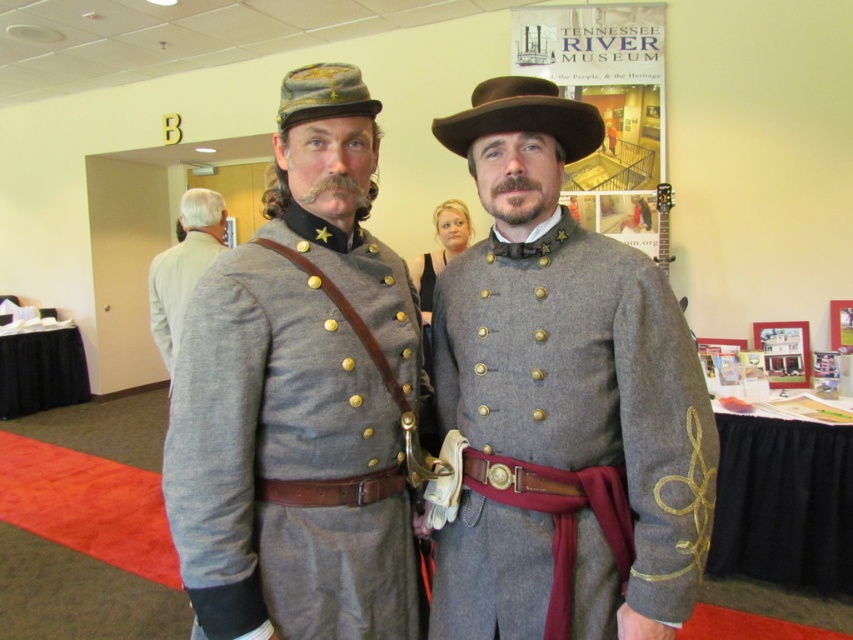
The width and height of the screenshot is (853, 640). What do you see at coordinates (300, 397) in the screenshot? I see `matte gray uniform at center` at bounding box center [300, 397].

Does matte gray uniform at center have a greater width compared to brown felt cowboy hat at center?

Indeed, matte gray uniform at center has a greater width compared to brown felt cowboy hat at center.

Locate an element on the screen. matte gray uniform at center is located at coordinates (300, 397).

Identify the location of matte gray uniform at center. (300, 397).

Is matte gray uniform at center bigger than gray wool uniform at left?

No, matte gray uniform at center is not bigger than gray wool uniform at left.

Image resolution: width=853 pixels, height=640 pixels. What do you see at coordinates (300, 397) in the screenshot?
I see `matte gray uniform at center` at bounding box center [300, 397].

The height and width of the screenshot is (640, 853). What do you see at coordinates (300, 397) in the screenshot?
I see `matte gray uniform at center` at bounding box center [300, 397].

Where is `matte gray uniform at center`? matte gray uniform at center is located at coordinates (300, 397).

Is matte gray uniform at center thinner than gray wool uniform at center?

Yes, matte gray uniform at center is thinner than gray wool uniform at center.

Between matte gray uniform at center and gray wool uniform at center, which one is positioned higher?

matte gray uniform at center

The height and width of the screenshot is (640, 853). I want to click on matte gray uniform at center, so click(300, 397).